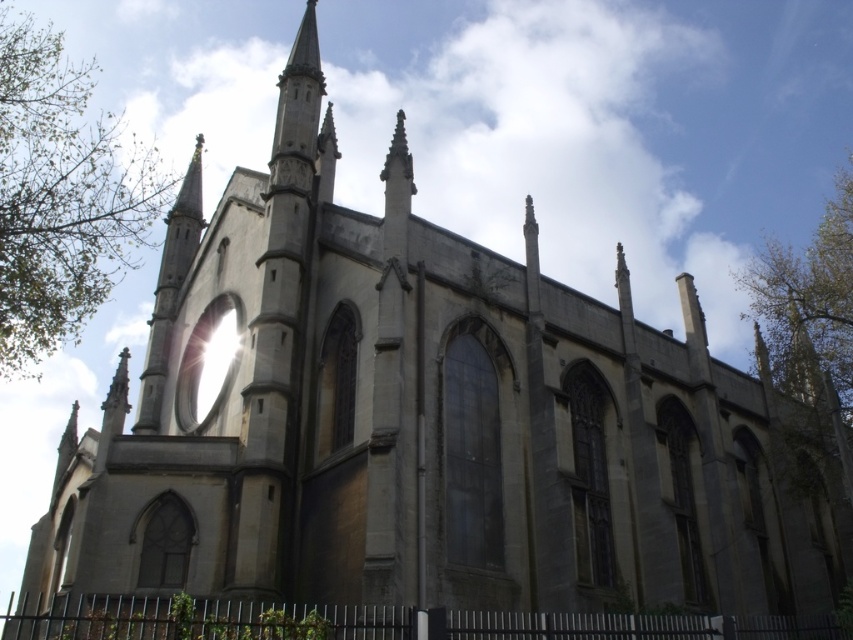
Which of these two, green leafy tree at left or green leafy tree at upper right, stands shorter?

green leafy tree at upper right is shorter.

Can you confirm if green leafy tree at left is positioned above green leafy tree at upper right?

Yes.

Who is more distant from viewer, (161,173) or (791,260)?

The point (161,173) is behind.

Locate an element on the screen. Image resolution: width=853 pixels, height=640 pixels. green leafy tree at left is located at coordinates (61, 195).